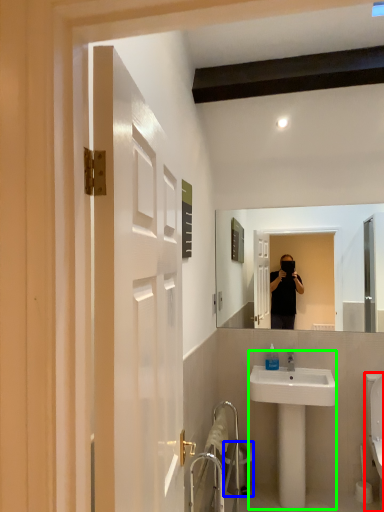
Question: Which is nearer to the toilet (highlighted by a red box)? trash bin/can (highlighted by a blue box) or sink (highlighted by a green box).

Choices:
 (A) trash bin/can
 (B) sink

Answer: (B)